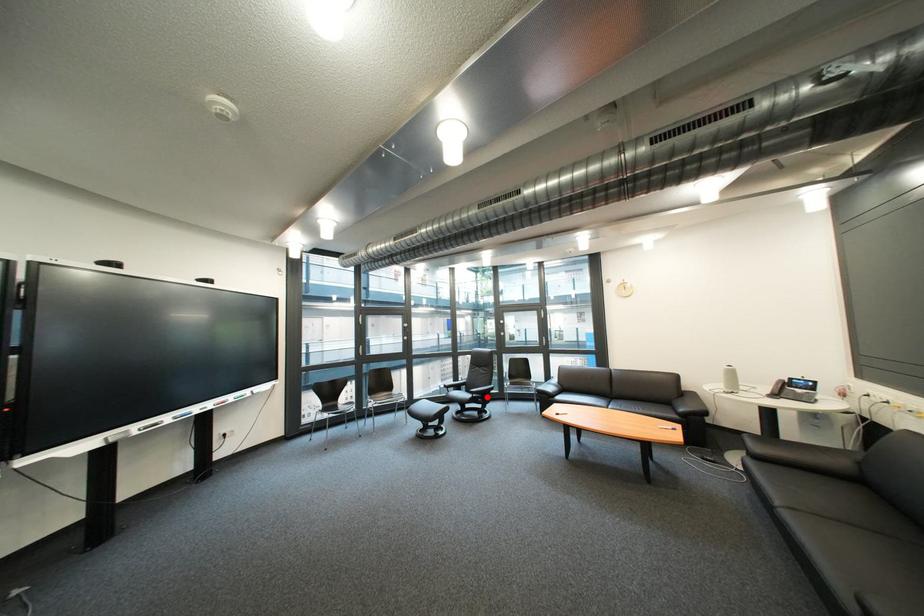
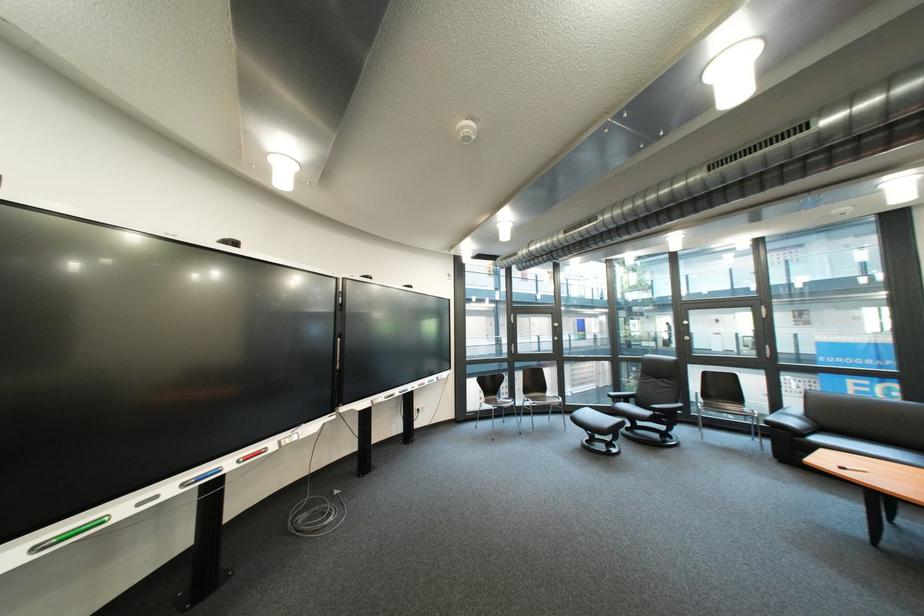
Find the pixel in the second image that matches the highlighted location in the first image.

(670, 415)